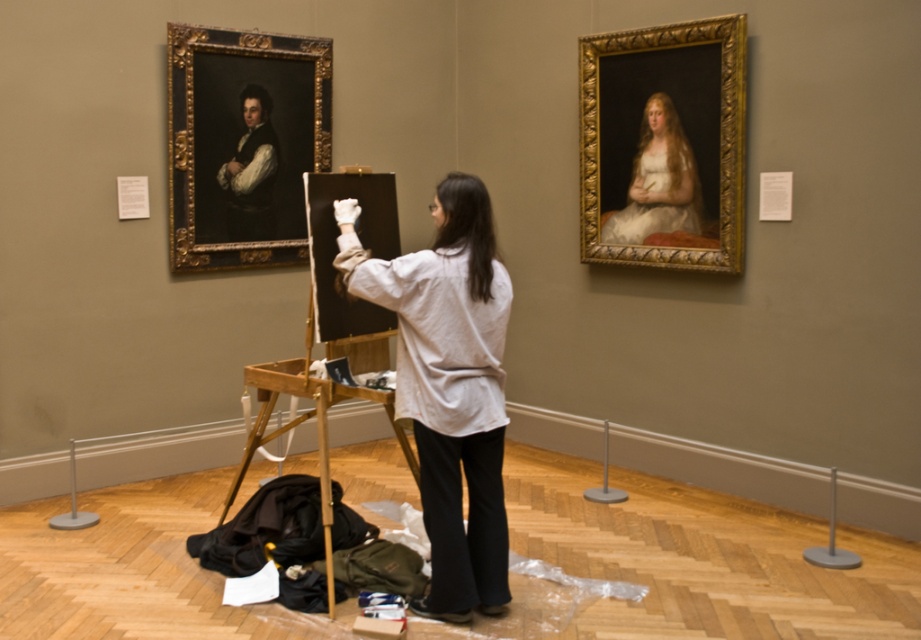
Does goldmaterial/texturepicture frame at upper left have a greater height compared to smooth black vest at upper left?

Yes, goldmaterial/texturepicture frame at upper left is taller than smooth black vest at upper left.

Is point (208, 243) positioned behind point (274, 228)?

No, it is in front of (274, 228).

Is point (313, 132) positioned after point (232, 196)?

That is True.

The width and height of the screenshot is (921, 640). What are the coordinates of `goldmaterial/texturepicture frame at upper left` in the screenshot? It's located at (243, 144).

Can you confirm if goldmaterial/texturepicture frame at upper left is positioned to the left of wooden easel at center?

Correct, you'll find goldmaterial/texturepicture frame at upper left to the left of wooden easel at center.

Does point (300, 88) come farther from viewer compared to point (416, 470)?

Yes, point (300, 88) is behind point (416, 470).

Between point (301, 83) and point (329, 515), which one is positioned behind?

The point (301, 83) is more distant.

Locate an element on the screen. goldmaterial/texturepicture frame at upper left is located at coordinates (243, 144).

Between wooden easel at center and smooth cream fabric at upper right, which one appears on the left side from the viewer's perspective?

wooden easel at center is more to the left.

Is point (368, 320) behind point (682, 164)?

No, (368, 320) is closer to viewer.

Is point (332, 401) positioned after point (690, 211)?

No, it is not.

You are a GUI agent. You are given a task and a screenshot of the screen. Output one action in this format:
    pyautogui.click(x=<x>, y=<y>)
    Task: Click on the wooden easel at center
    
    Given the screenshot: What is the action you would take?
    pyautogui.click(x=333, y=324)